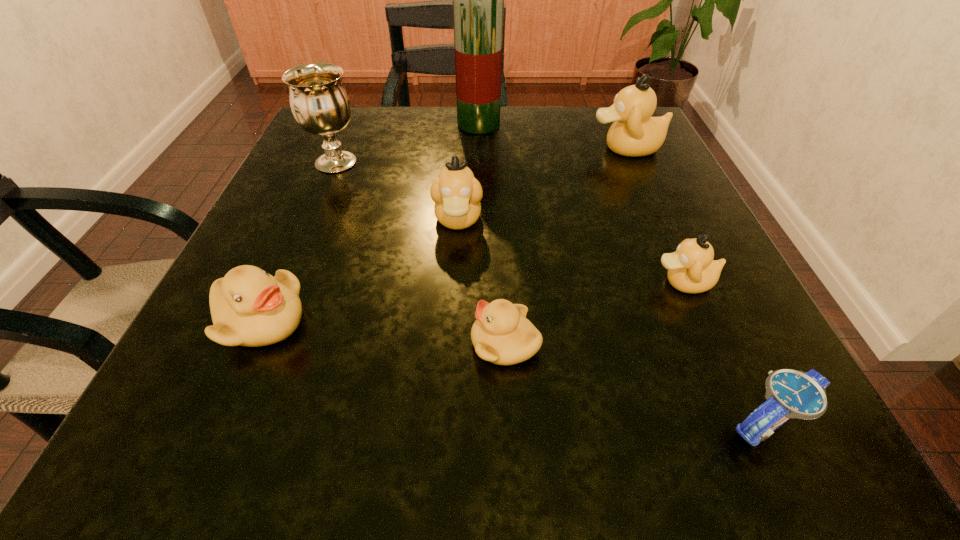
Image resolution: width=960 pixels, height=540 pixels. In the image, there is a desktop. Find the location of `vacant space at the left edge`. vacant space at the left edge is located at coordinates (320, 206).

Locate an element on the screen. This screenshot has height=540, width=960. vacant space at the right edge of the desktop is located at coordinates (676, 200).

You are a GUI agent. You are given a task and a screenshot of the screen. Output one action in this format:
    pyautogui.click(x=<x>, y=<y>)
    Task: Click on the free spot at the near left corner of the desktop
    
    Given the screenshot: What is the action you would take?
    pyautogui.click(x=144, y=451)

You are a GUI agent. You are given a task and a screenshot of the screen. Output one action in this format:
    pyautogui.click(x=<x>, y=<y>)
    Task: Click on the vacant region at the far right corner of the desktop
    The height and width of the screenshot is (540, 960).
    Given the screenshot: What is the action you would take?
    pyautogui.click(x=609, y=153)

This screenshot has width=960, height=540. Find the location of `vacant space at the near right corner of the desktop`. vacant space at the near right corner of the desktop is located at coordinates (815, 420).

You are a GUI agent. You are given a task and a screenshot of the screen. Output one action in this format:
    pyautogui.click(x=<x>, y=<y>)
    Task: Click on the vacant space that is in between the liquor and the smallest tan duckling
    The image size is (960, 540).
    Given the screenshot: What is the action you would take?
    pyautogui.click(x=581, y=204)

At what (x,y) coordinates should I click in order to perform the action: click on vacant space that is in between the left yellow duckling and the smallest tan duckling. Please return your answer as a coordinate pair (x, y). Looking at the image, I should click on (472, 302).

At what (x,y) coordinates should I click in order to perform the action: click on free spot between the chalice and the watch. Please return your answer as a coordinate pair (x, y). This screenshot has width=960, height=540. Looking at the image, I should click on (552, 293).

Identify the location of free area in between the right yellow duckling and the leftmost duckling. (383, 333).

You are a GUI agent. You are given a task and a screenshot of the screen. Output one action in this format:
    pyautogui.click(x=<x>, y=<y>)
    Task: Click on the vacant region between the tallest object and the farthest tan duckling
    The image size is (960, 540).
    Given the screenshot: What is the action you would take?
    pyautogui.click(x=552, y=137)